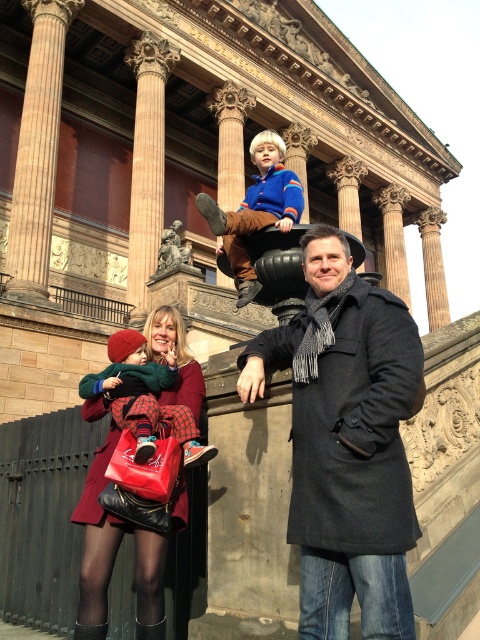
Based on the scene description, where is the brown polished stone column at upper center located in the image?

The brown polished stone column at upper center is located at the 2D coordinates point (146, 163) in the image.

You are a photographer trying to capture a clear shot of both the dark gray wool coat at center and the velvety brown pants at upper center. However, the camera can only focus on one object at a time. Which object should you focus on to ensure the other is still in the background?

You should focus on the dark gray wool coat at center because it is in front of the velvety brown pants at upper center, so if you focus on the coat, the pants will naturally be in the background.